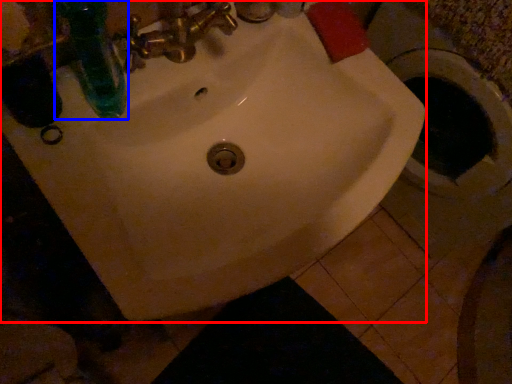
Question: Which point is closer to the camera, sink (highlighted by a red box) or bottle (highlighted by a blue box)?

Choices:
 (A) sink
 (B) bottle

Answer: (B)